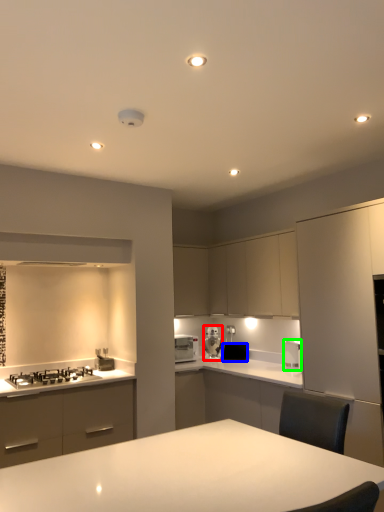
Question: Based on their relative distances, which object is nearer to kitchen appliance (highlighted by a red box)? Choose from appliance (highlighted by a blue box) and kitchen appliance (highlighted by a green box).

Choices:
 (A) appliance
 (B) kitchen appliance

Answer: (A)